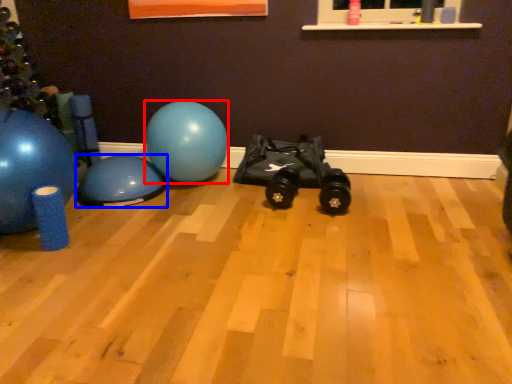
Question: Which point is closer to the camera, ball (highlighted by a red box) or ball (highlighted by a blue box)?

Choices:
 (A) ball
 (B) ball

Answer: (B)